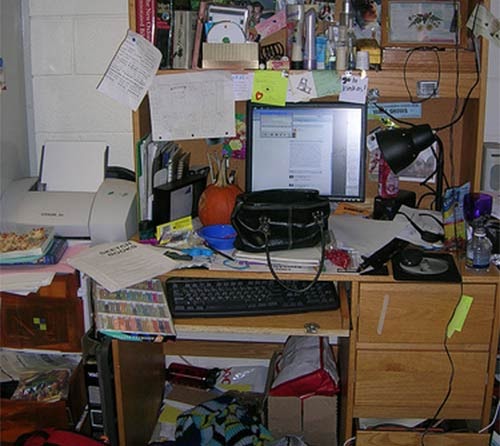
The image size is (500, 446). Identify the location of fax machine. (112, 201).